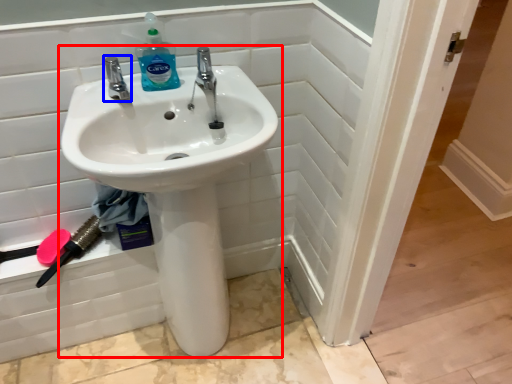
Question: Which object appears farthest to the camera in this image, sink (highlighted by a red box) or tap (highlighted by a blue box)?

Choices:
 (A) sink
 (B) tap

Answer: (B)